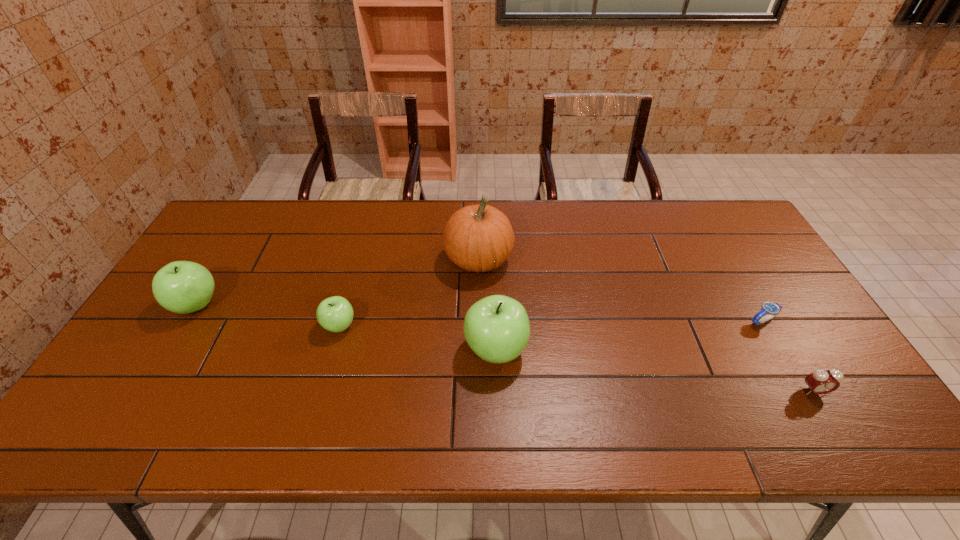
Find the location of a particular element. The height and width of the screenshot is (540, 960). vacant space that satisfies the following two spatial constraints: 1. on the stem of the farthest object; 2. on the back side of the shortest object is located at coordinates (479, 321).

At what (x,y) coordinates should I click in order to perform the action: click on free spot that satisfies the following two spatial constraints: 1. on the stem of the farthest object; 2. on the back side of the rightmost apple. Please return your answer as a coordinate pair (x, y). The height and width of the screenshot is (540, 960). Looking at the image, I should click on (479, 349).

What are the coordinates of `free space that satisfies the following two spatial constraints: 1. on the back side of the second object from left to right; 2. on the right side of the shortest object` in the screenshot? It's located at (341, 321).